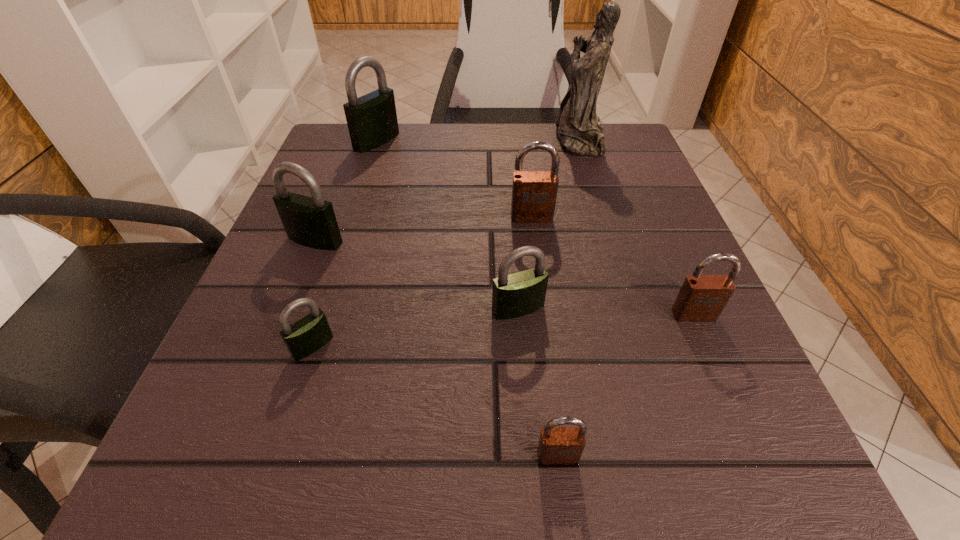
You are a GUI agent. You are given a task and a screenshot of the screen. Output one action in this format:
    pyautogui.click(x=<x>, y=<y>)
    Task: Click on the rightmost black padlock
    The image size is (960, 540).
    Given the screenshot: What is the action you would take?
    pyautogui.click(x=518, y=294)

The height and width of the screenshot is (540, 960). In order to click on the second nearest black padlock in this screenshot , I will do `click(518, 294)`.

You are a GUI agent. You are given a task and a screenshot of the screen. Output one action in this format:
    pyautogui.click(x=<x>, y=<y>)
    Task: Click on the second nearest padlock
    
    Given the screenshot: What is the action you would take?
    pyautogui.click(x=306, y=336)

Locate an element on the screen. Image resolution: width=960 pixels, height=540 pixels. the smallest black padlock is located at coordinates (306, 336).

What are the coordinates of `the nearest object` in the screenshot? It's located at (557, 445).

Where is `the nearest brown padlock`? the nearest brown padlock is located at coordinates (557, 445).

The height and width of the screenshot is (540, 960). I want to click on vacant area situated on the front-facing side of the figurine, so click(x=458, y=140).

Locate an element on the screen. The width and height of the screenshot is (960, 540). free space located on the front-facing side of the figurine is located at coordinates (382, 140).

I want to click on free space located on the front-facing side of the figurine, so click(476, 140).

Identify the location of vacant space positioned 0.370m on the front of the tallest padlock. (333, 277).